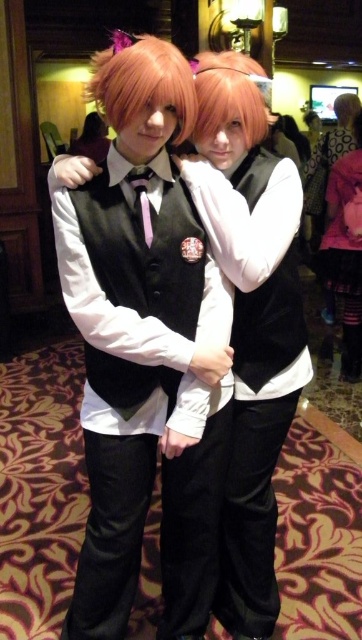
Question: Which point is farther to the camera?

Choices:
 (A) coord(200,116)
 (B) coord(254,284)

Answer: (B)

Question: Can you confirm if pink fabric dress at lower right is positioned below blonde hair at center?

Choices:
 (A) no
 (B) yes

Answer: (B)

Question: Where is blonde hair at center located in relation to pink silky hair at center in the image?

Choices:
 (A) left
 (B) right

Answer: (A)

Question: Based on their relative distances, which object is farther from the matte black vest at center?

Choices:
 (A) pink fabric dress at lower right
 (B) blonde synthetic wig at center
 (C) pink silky hair at center

Answer: (C)

Question: Which point appears farthest from the camera in this image?

Choices:
 (A) (133, 61)
 (B) (247, 68)
 (C) (163, 72)
 (D) (354, 202)

Answer: (D)

Question: Is blonde synthetic wig at center to the left of pink silky hair at center from the viewer's perspective?

Choices:
 (A) no
 (B) yes

Answer: (B)